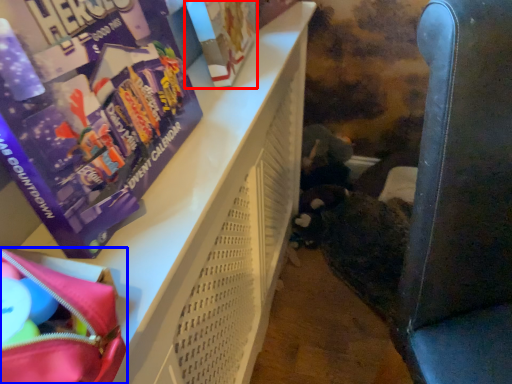
Question: Which point is closer to the camera, paperback book (highlighted by a red box) or bag (highlighted by a blue box)?

Choices:
 (A) paperback book
 (B) bag

Answer: (B)